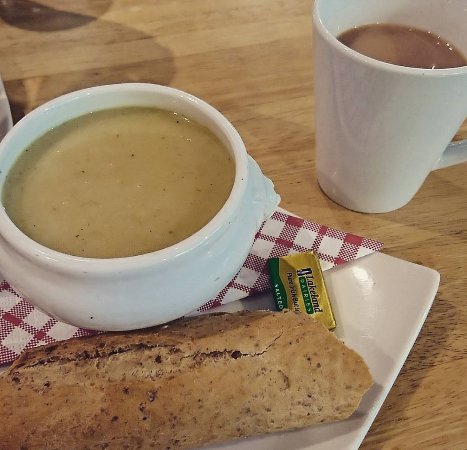
Where is `napkin`? The image size is (467, 450). napkin is located at coordinates (19, 331).